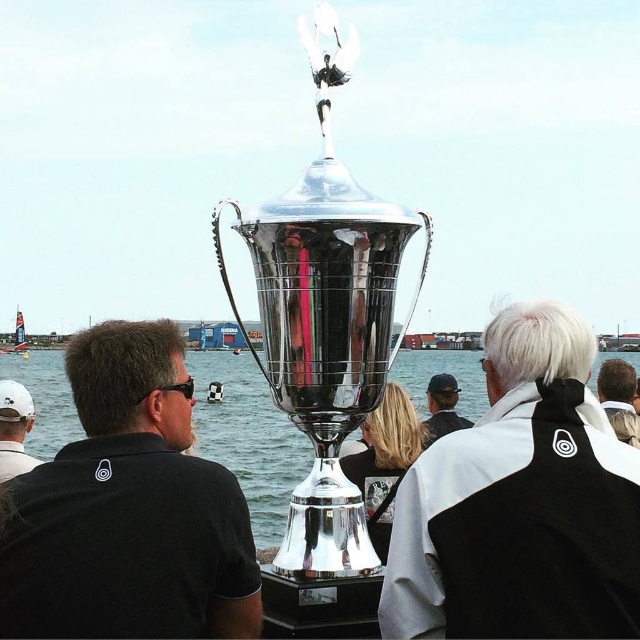
Question: Among these points, which one is farthest from the camera?

Choices:
 (A) (484, 406)
 (B) (99, 529)

Answer: (A)

Question: Is polished silver trophy at center positioned before white matte baseball cap at left?

Choices:
 (A) yes
 (B) no

Answer: (A)

Question: Is black/white jacket at center closer to the viewer compared to light brown hair at center?

Choices:
 (A) no
 (B) yes

Answer: (B)

Question: Which point appears closest to the camera in this image?

Choices:
 (A) (52, 404)
 (B) (448, 384)
 (C) (20, 465)
 (D) (305, 49)

Answer: (D)

Question: Where is black/white jacket at center located in relation to shiny silver trophy at center in the image?

Choices:
 (A) right
 (B) left

Answer: (A)

Question: Considering the real-world distances, which object is farthest from the black matte shirt at center?

Choices:
 (A) polished silver trophy at center
 (B) white matte baseball cap at left
 (C) black cap at center
 (D) black/white jacket at center

Answer: (C)